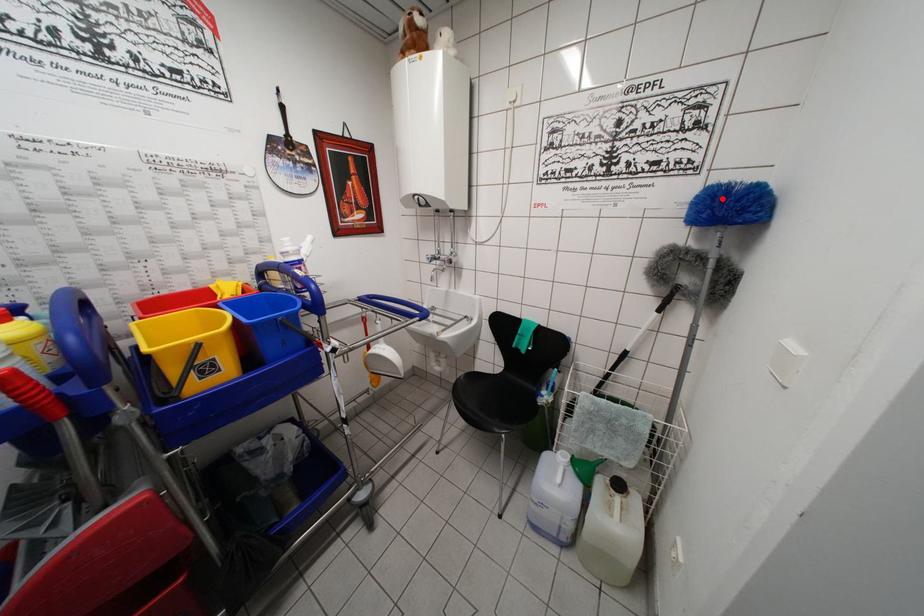
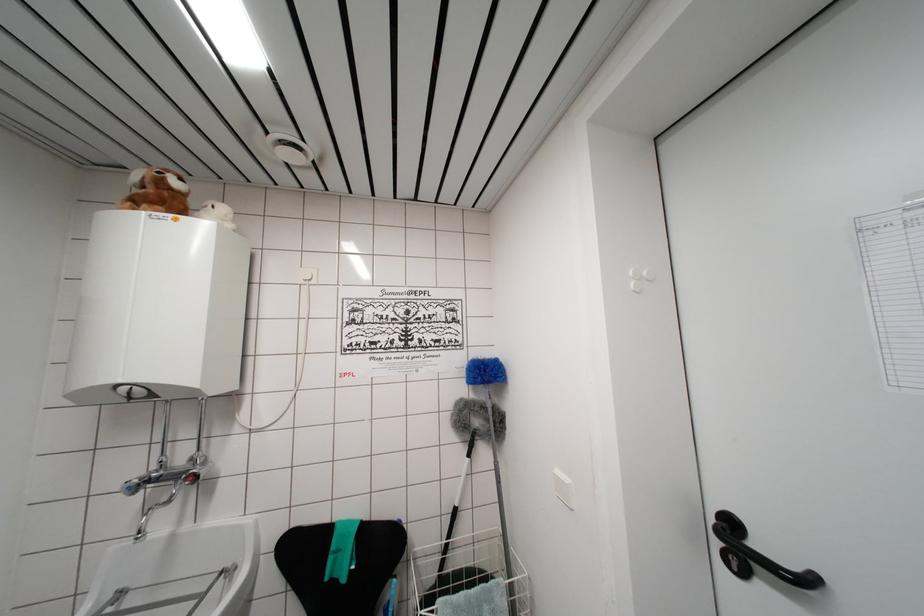
Where in the second image is the point corresponding to the highlighted location from the first image?

(484, 371)